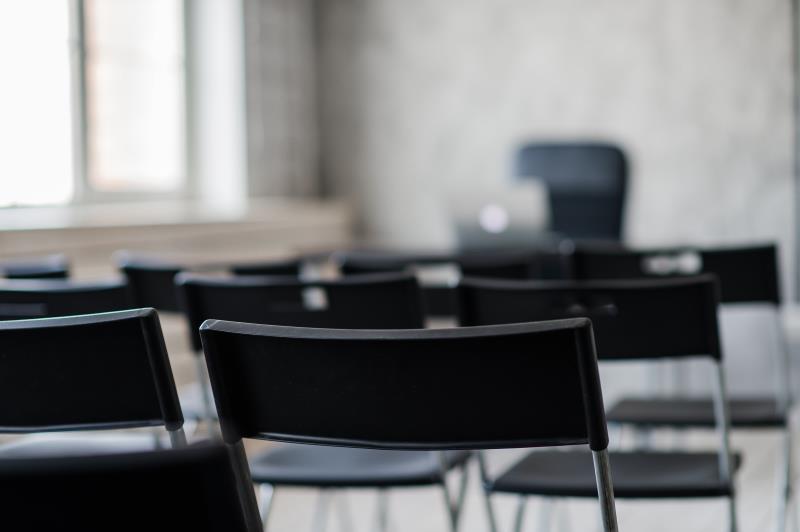
Find the location of a particular element. This screenshot has width=800, height=532. seat of chair is located at coordinates coord(344,457), coord(626,467), coord(656,410), coord(192,388).